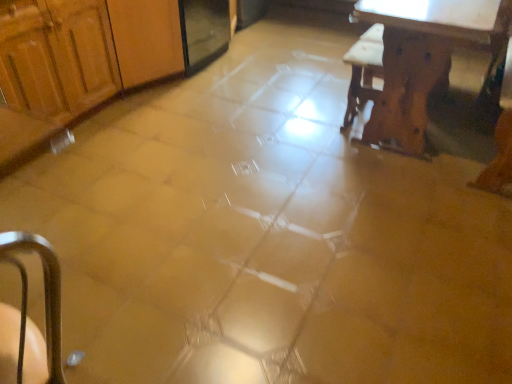
Question: From the image's perspective, is wooden table at upper right above wooden cabinet at left?

Choices:
 (A) yes
 (B) no

Answer: (B)

Question: Is wooden table at upper right outside of wooden cabinet at left?

Choices:
 (A) no
 (B) yes

Answer: (B)

Question: Does wooden table at upper right have a greater width compared to wooden cabinet at left?

Choices:
 (A) yes
 (B) no

Answer: (A)

Question: Is wooden table at upper right thinner than wooden cabinet at left?

Choices:
 (A) yes
 (B) no

Answer: (B)

Question: Does wooden table at upper right appear on the left side of wooden cabinet at left?

Choices:
 (A) yes
 (B) no

Answer: (B)

Question: Does wooden table at upper right come behind wooden cabinet at left?

Choices:
 (A) yes
 (B) no

Answer: (B)

Question: Is wooden cabinet at left to the right of wooden table at upper right from the viewer's perspective?

Choices:
 (A) no
 (B) yes

Answer: (A)

Question: Can you confirm if wooden cabinet at left is thinner than wooden table at upper right?

Choices:
 (A) no
 (B) yes

Answer: (B)

Question: Considering the relative sizes of wooden cabinet at left and wooden table at upper right in the image provided, is wooden cabinet at left bigger than wooden table at upper right?

Choices:
 (A) no
 (B) yes

Answer: (A)

Question: Is wooden cabinet at left closer to the viewer compared to wooden table at upper right?

Choices:
 (A) no
 (B) yes

Answer: (A)

Question: Are wooden cabinet at left and wooden table at upper right beside each other?

Choices:
 (A) no
 (B) yes

Answer: (A)

Question: Is wooden cabinet at left aimed at wooden table at upper right?

Choices:
 (A) yes
 (B) no

Answer: (A)

Question: From a real-world perspective, is wooden cabinet at left positioned above or below wooden table at upper right?

Choices:
 (A) below
 (B) above

Answer: (B)